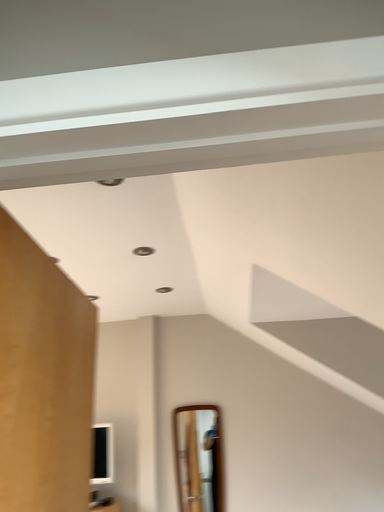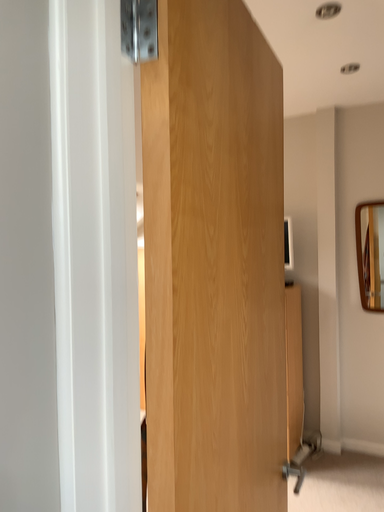
Question: Which way did the camera rotate in the video?

Choices:
 (A) rotated upward
 (B) rotated downward

Answer: (B)